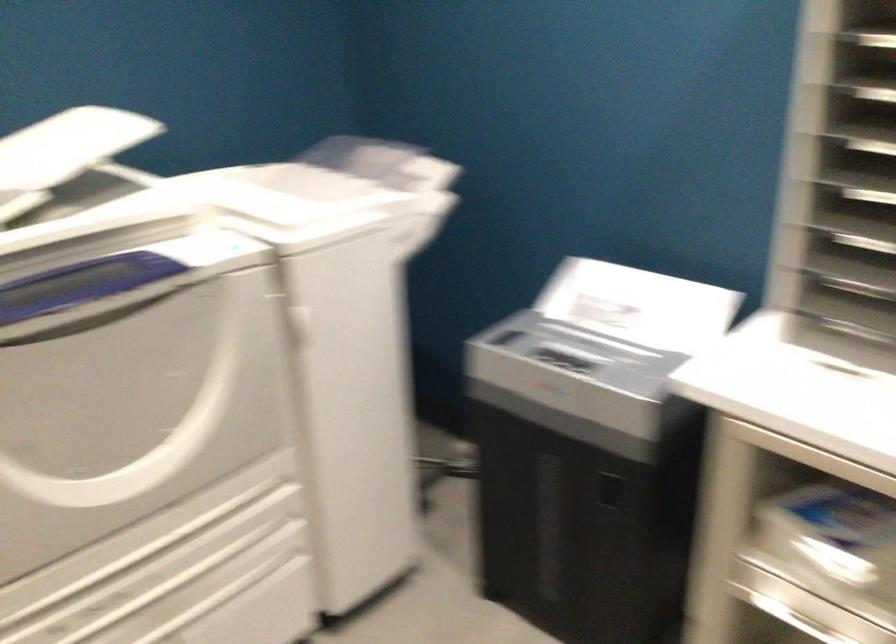
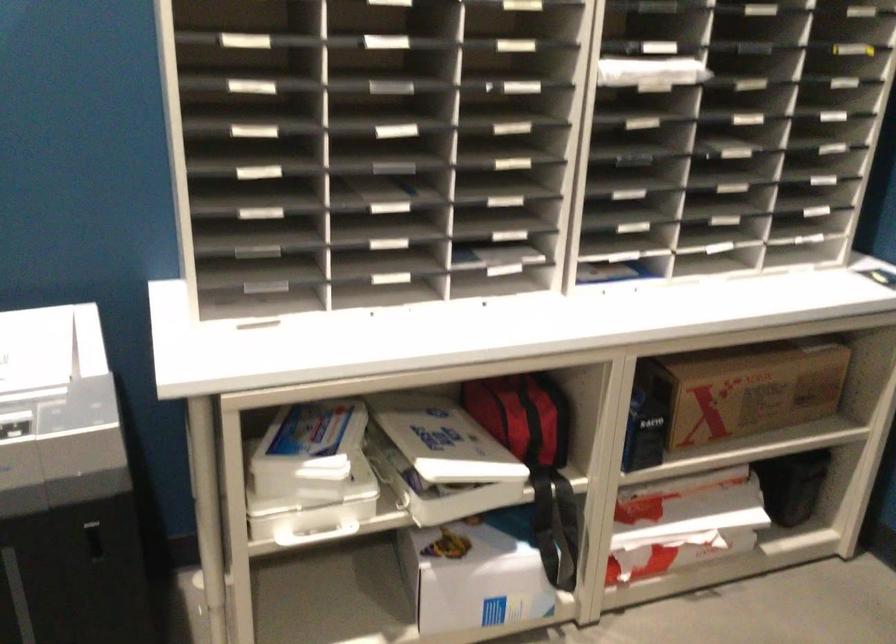
Question: The images are taken continuously from a first-person perspective. In which direction is your viewpoint rotating?

Choices:
 (A) Left
 (B) Right
 (C) Up
 (D) Down

Answer: (B)